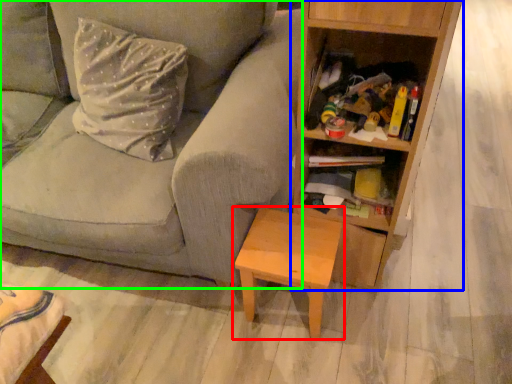
Question: Based on their relative distances, which object is farther from table (highlighted by a red box)? Choose from bookcase (highlighted by a blue box) and studio couch (highlighted by a green box).

Choices:
 (A) bookcase
 (B) studio couch

Answer: (B)